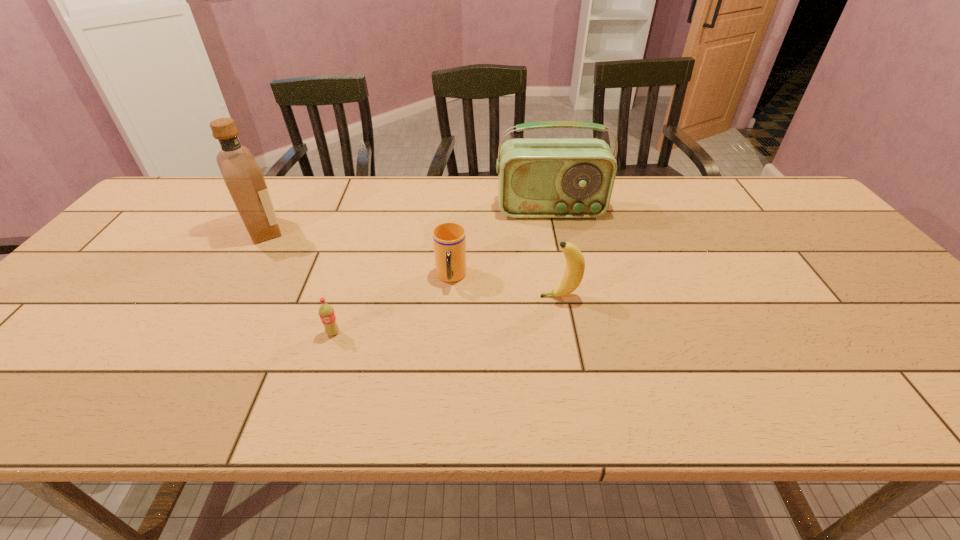
At what (x,y) coordinates should I click in order to perform the action: click on vacant space at the far left corner of the desktop. Please return your answer as a coordinate pair (x, y). Image resolution: width=960 pixels, height=540 pixels. Looking at the image, I should click on (210, 181).

The height and width of the screenshot is (540, 960). I want to click on free space between the fourth tallest object and the fourth shortest object, so click(501, 244).

Image resolution: width=960 pixels, height=540 pixels. What are the coordinates of `free space between the shortest object and the banana` in the screenshot? It's located at (446, 314).

Where is `vacant space that's between the leftmost object and the banana`? vacant space that's between the leftmost object and the banana is located at coordinates (412, 263).

Locate an element on the screen. This screenshot has height=540, width=960. vacant area between the third object from left to right and the leftmost object is located at coordinates (357, 254).

The height and width of the screenshot is (540, 960). I want to click on vacant space in between the cup and the leftmost object, so click(x=357, y=254).

The height and width of the screenshot is (540, 960). I want to click on free space between the nearest object and the third shortest object, so click(446, 314).

Where is `vacant space in between the soda and the third tallest object`? The width and height of the screenshot is (960, 540). vacant space in between the soda and the third tallest object is located at coordinates (446, 314).

What are the coordinates of `free spot between the radio receiver and the fourth tallest object` in the screenshot? It's located at (501, 244).

Where is `vacant point located between the soda and the leftmost object`? Image resolution: width=960 pixels, height=540 pixels. vacant point located between the soda and the leftmost object is located at coordinates (299, 281).